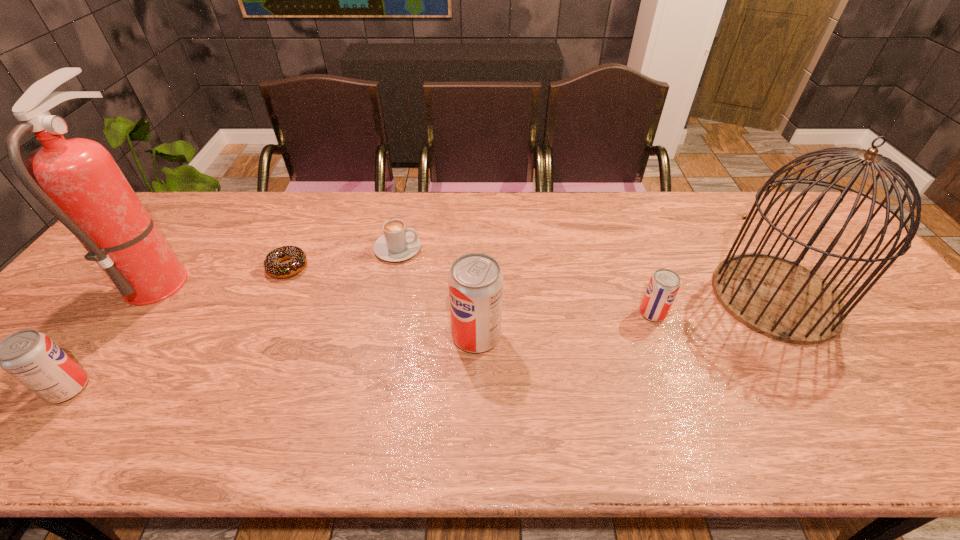
Image resolution: width=960 pixels, height=540 pixels. Find the location of `vacant space at the right edge of the desktop`. vacant space at the right edge of the desktop is located at coordinates (809, 259).

Identify the location of free space at the near left corner. This screenshot has height=540, width=960. (20, 396).

In the image, there is a desktop. Where is `free space at the far right corner`? This screenshot has height=540, width=960. free space at the far right corner is located at coordinates (780, 213).

Locate an element on the screen. This screenshot has height=540, width=960. vacant point located between the second shortest object and the shortest soda is located at coordinates (525, 281).

Where is `empty space that is in between the fire extinguisher and the nearest object`? Image resolution: width=960 pixels, height=540 pixels. empty space that is in between the fire extinguisher and the nearest object is located at coordinates (114, 333).

In order to click on vacant space in between the third tallest object and the nearest soda in this screenshot , I will do `click(272, 362)`.

Identify the location of vacant space that is in between the second shortest soda and the fourth object from right to left. This screenshot has height=540, width=960. (233, 318).

This screenshot has height=540, width=960. I want to click on free space between the birdcage and the cappuccino, so click(587, 273).

At what (x,y) coordinates should I click in order to perform the action: click on blank region between the second object from right to left and the tallest soda. Please return your answer as a coordinate pair (x, y). Image resolution: width=960 pixels, height=540 pixels. Looking at the image, I should click on (564, 324).

You are a GUI agent. You are given a task and a screenshot of the screen. Output one action in this format:
    pyautogui.click(x=<x>, y=<y>)
    Task: Click on the unoccupied area between the nearest soda and the fourth object from right to left
    This screenshot has height=540, width=960.
    Given the screenshot: What is the action you would take?
    pyautogui.click(x=233, y=318)